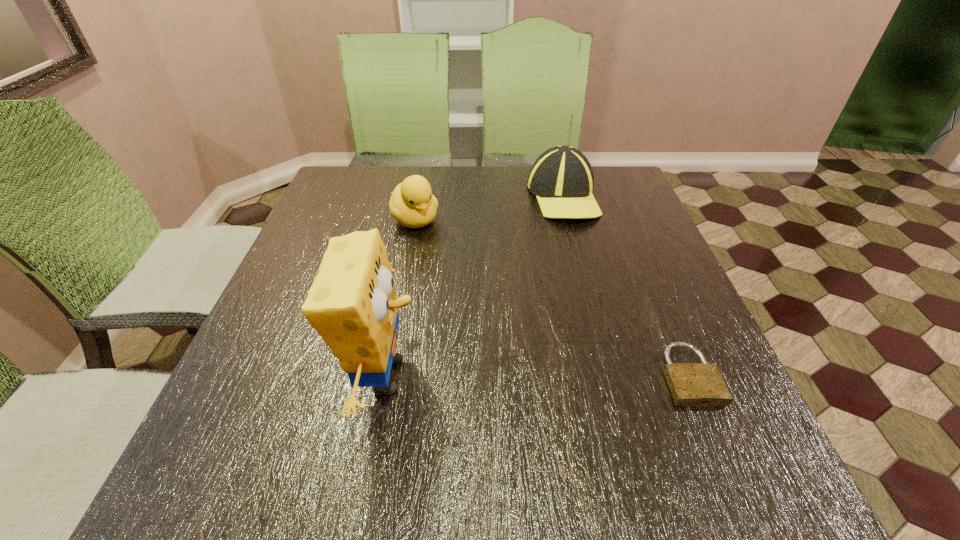
Image resolution: width=960 pixels, height=540 pixels. What are the coordinates of `vacant space in between the second object from right to left and the sponge` in the screenshot? It's located at (474, 286).

Identify the location of vacant area between the duck and the third tallest object. (489, 208).

You are a GUI agent. You are given a task and a screenshot of the screen. Output one action in this format:
    pyautogui.click(x=<x>, y=<y>)
    Task: Click on the vacant region between the rightmost object and the third object from left to right
    
    Given the screenshot: What is the action you would take?
    pyautogui.click(x=625, y=286)

Locate an element on the screen. This screenshot has width=960, height=540. free space that is in between the shortest object and the sponge is located at coordinates (537, 375).

What are the coordinates of `vacant space in between the rightmost object and the duck` in the screenshot? It's located at (552, 298).

Where is `empty location between the second object from right to left and the duck`? empty location between the second object from right to left and the duck is located at coordinates (489, 208).

Identify the location of free area in between the third object from left to right and the duck. This screenshot has height=540, width=960. click(489, 208).

Locate an element on the screen. The height and width of the screenshot is (540, 960). object that can be found as the third closest to the duck is located at coordinates (691, 384).

Where is `object that is the closest to the sponge`? object that is the closest to the sponge is located at coordinates (412, 204).